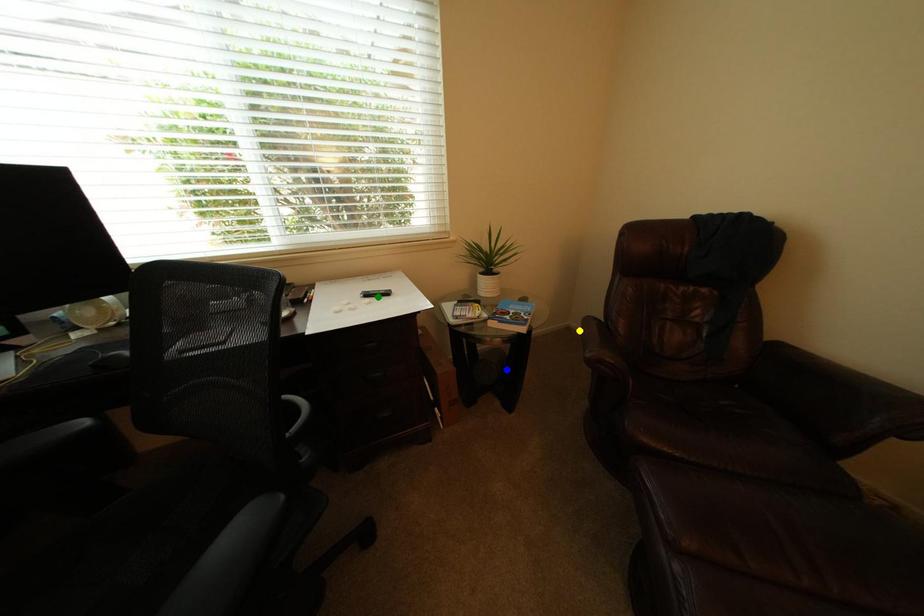
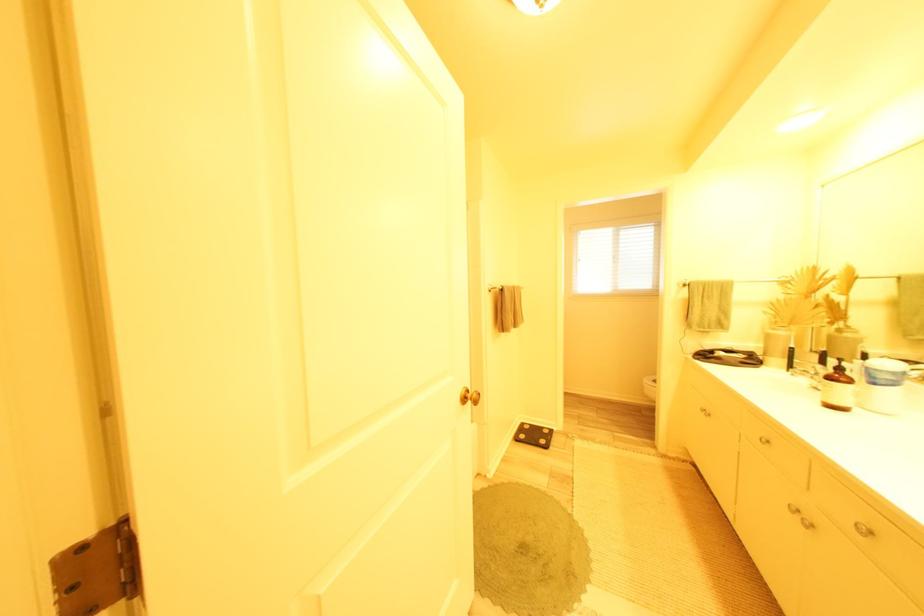
I am providing you with two images of the same scene from different viewpoints. Three points are marked in image1. Which point corresponds to a part or object that is occluded in image2?In image1, three points are marked. Which of them correspond to a part or object that is occluded in image2?Among the three points shown in image1, which one corresponds to a part or object that is no longer visible due to occlusion in image2?

green point, blue point, yellow point